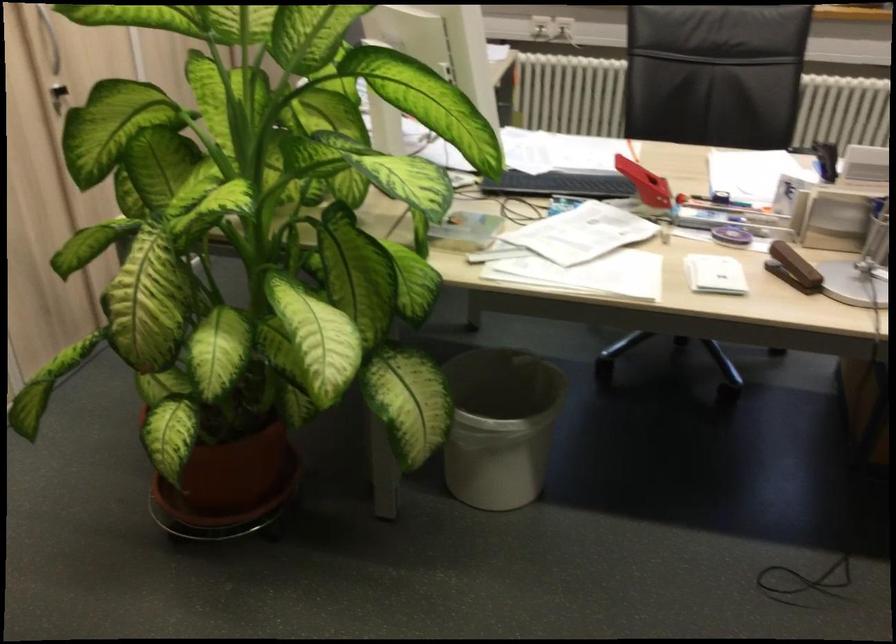
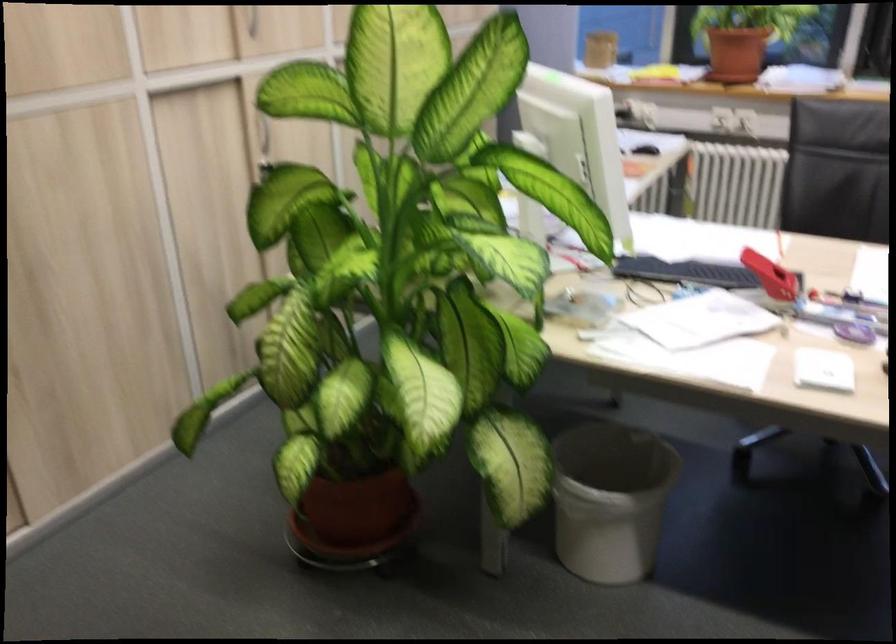
Question: The images are taken continuously from a first-person perspective. In which direction is your viewpoint rotating?

Choices:
 (A) Left
 (B) Right
 (C) Up
 (D) Down

Answer: (A)